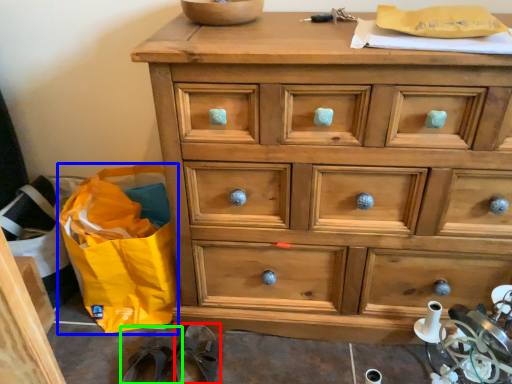
Question: Which object is the farthest from slipper (highlighted by a red box)? Choose among these: shopping bag (highlighted by a blue box) or slipper (highlighted by a green box).

Choices:
 (A) shopping bag
 (B) slipper

Answer: (A)